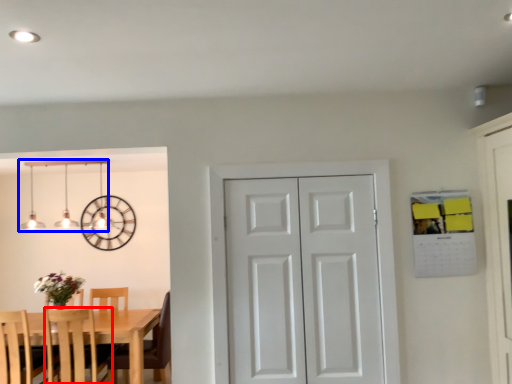
Question: Which point is closer to the camera, chair (highlighted by a red box) or lamp (highlighted by a blue box)?

Choices:
 (A) chair
 (B) lamp

Answer: (A)